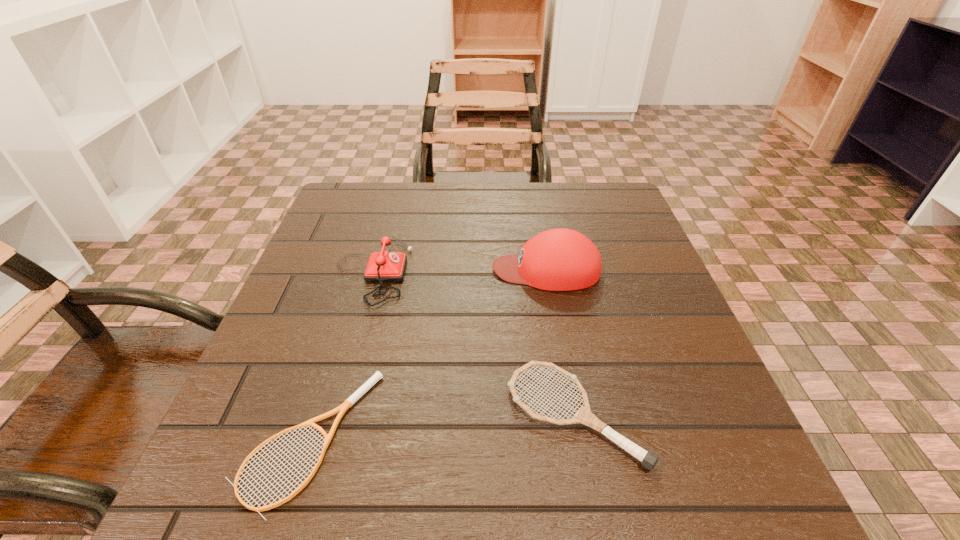
Locate an element on the screen. This screenshot has width=960, height=540. free space located 0.230m on the left of the second shortest object is located at coordinates (360, 415).

You are a GUI agent. You are given a task and a screenshot of the screen. Output one action in this format:
    pyautogui.click(x=<x>, y=<y>)
    Task: Click on the blank space located 0.350m on the right of the shortest object
    
    Given the screenshot: What is the action you would take?
    pyautogui.click(x=607, y=439)

The width and height of the screenshot is (960, 540). Identify the location of telephone situated at the left edge. pyautogui.click(x=384, y=266).

The width and height of the screenshot is (960, 540). Identify the location of tennis racket at the left edge. (348, 403).

Where is `baseball cap that is at the right edge`? This screenshot has height=540, width=960. baseball cap that is at the right edge is located at coordinates (560, 259).

Find the location of a particular element. This screenshot has width=960, height=540. tennis racket present at the right edge is located at coordinates (584, 416).

This screenshot has height=540, width=960. I want to click on object present at the near left corner, so 348,403.

In order to click on object that is at the near right corner in this screenshot , I will do `click(584, 416)`.

Find the location of a particular element. The image size is (960, 540). free space at the far edge of the desktop is located at coordinates (463, 185).

Find the location of a particular element. This screenshot has height=540, width=960. blank space at the near edge is located at coordinates (579, 523).